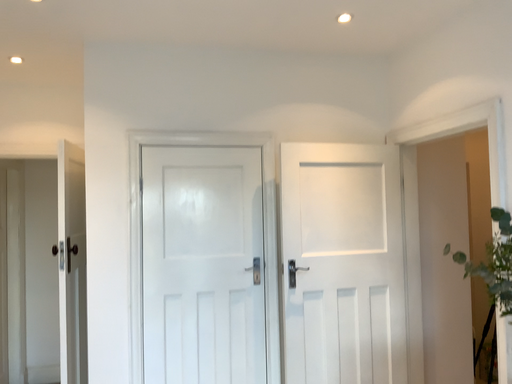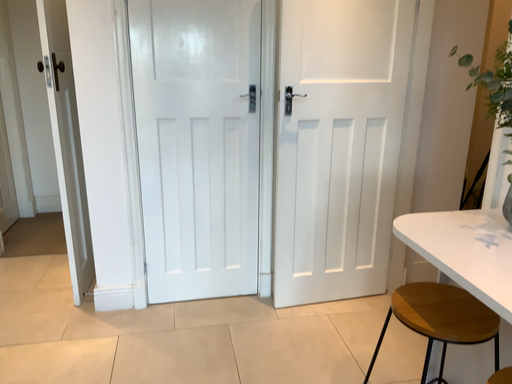
Question: How did the camera likely rotate when shooting the video?

Choices:
 (A) rotated downward
 (B) rotated upward

Answer: (A)